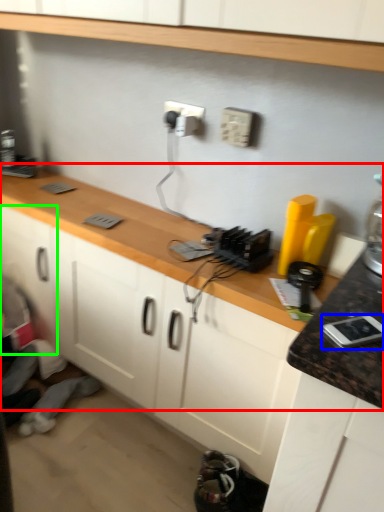
Question: Estimate the real-world distances between objects in this image. Which object is closer to countertop (highlighted by a red box), appliance (highlighted by a blue box) or cabinetry (highlighted by a green box)?

Choices:
 (A) appliance
 (B) cabinetry

Answer: (B)